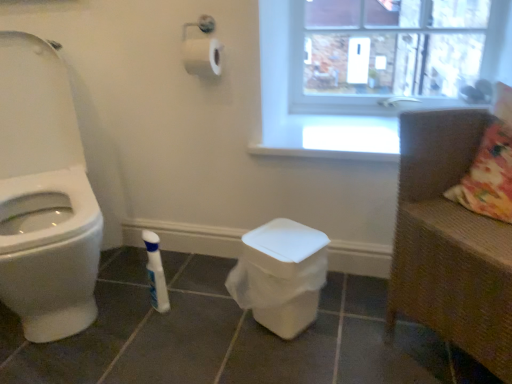
Question: Choose the correct answer: Is brown woven armchair at right inside white glossy bottle at lower center or outside it?

Choices:
 (A) inside
 (B) outside

Answer: (B)

Question: From the image's perspective, is brown woven armchair at right above or below white glossy bottle at lower center?

Choices:
 (A) below
 (B) above

Answer: (B)

Question: Which object is positioned closest to the brown woven armchair at right?

Choices:
 (A) transparent plastic window screen at upper right
 (B) white glossy bottle at lower center

Answer: (A)

Question: Which of these objects is positioned closest to the brown woven armchair at right?

Choices:
 (A) transparent plastic window screen at upper right
 (B) white glossy bottle at lower center

Answer: (A)